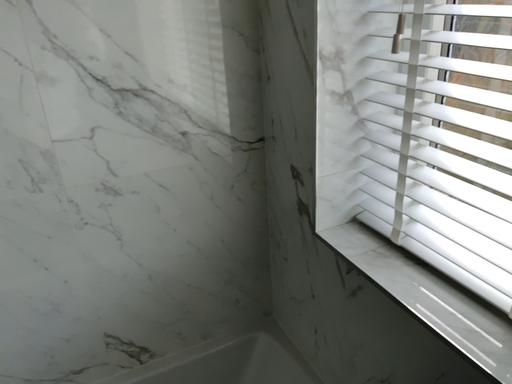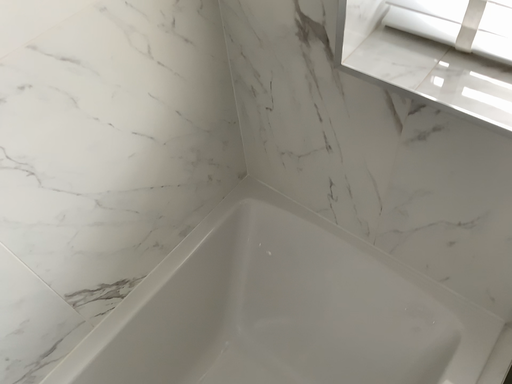
Question: How did the camera likely rotate when shooting the video?

Choices:
 (A) rotated left
 (B) rotated right

Answer: (B)